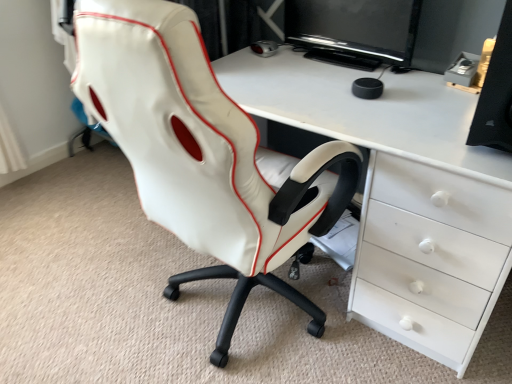
Question: From their relative heights in the image, would you say black glossy monitor at upper center is taller or shorter than white leather chair at center?

Choices:
 (A) tall
 (B) short

Answer: (B)

Question: Considering the positions of black glossy monitor at upper center and white leather chair at center in the image, is black glossy monitor at upper center wider or thinner than white leather chair at center?

Choices:
 (A) wide
 (B) thin

Answer: (B)

Question: Which is nearer to the black matte speaker at right?

Choices:
 (A) white leather chair at center
 (B) white glossy desk at center
 (C) black glossy monitor at upper center

Answer: (B)

Question: Considering the real-world distances, which object is farthest from the white glossy desk at center?

Choices:
 (A) white leather chair at center
 (B) black matte speaker at right
 (C) black glossy monitor at upper center

Answer: (C)